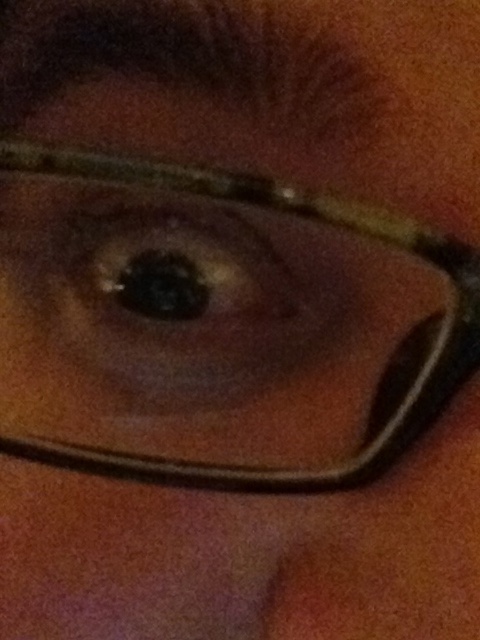
You are a photographer adjusting the focus on a camera. You notice the matte brown glasses at center and the brown matte eye at center in your viewfinder. Which object is closer to the camera lens? Please explain your reasoning based on their distance from each other.

The matte brown glasses at center is 3.98 centimeters from the brown matte eye at center. Since the glasses are positioned closer to the eye, they would be nearer to the camera lens compared to the eye itself.